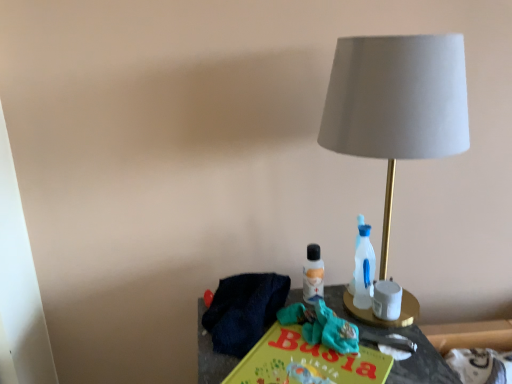
Question: In the image, is matte black book at center on the left side or the right side of yellow matte paper at center?

Choices:
 (A) left
 (B) right

Answer: (B)

Question: Is matte black book at center bigger or smaller than yellow matte paper at center?

Choices:
 (A) big
 (B) small

Answer: (A)

Question: Estimate the real-world distances between objects in this image. Which object is farther from the matte black book at center?

Choices:
 (A) matte gray fabric lampshade at right
 (B) yellow matte paper at center
 (C) teal fabric scrub at center
 (D) white matte candle holder at right

Answer: (A)

Question: Which object is the farthest from the teal fabric scrub at center?

Choices:
 (A) matte black book at center
 (B) matte gray fabric lampshade at right
 (C) yellow matte paper at center
 (D) white matte candle holder at right

Answer: (B)